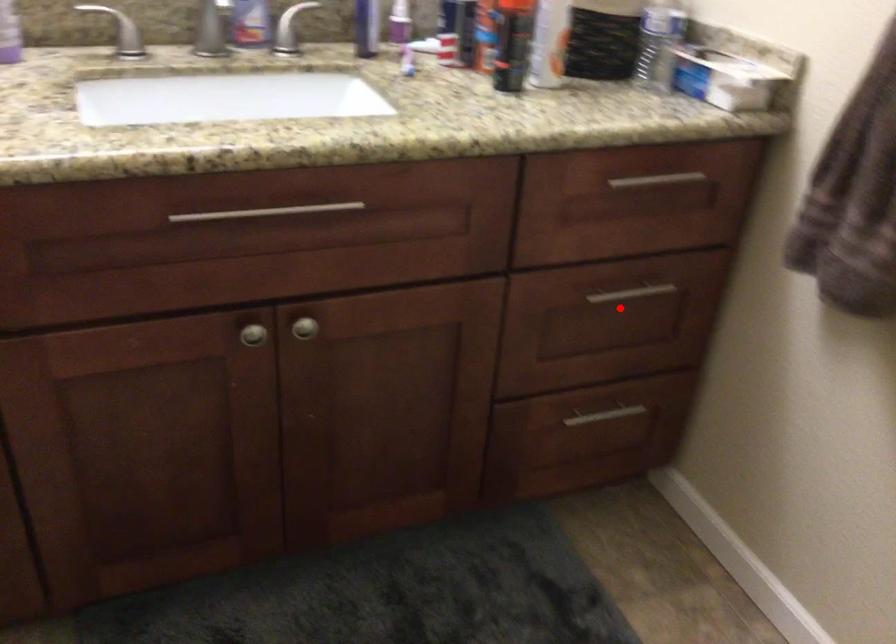
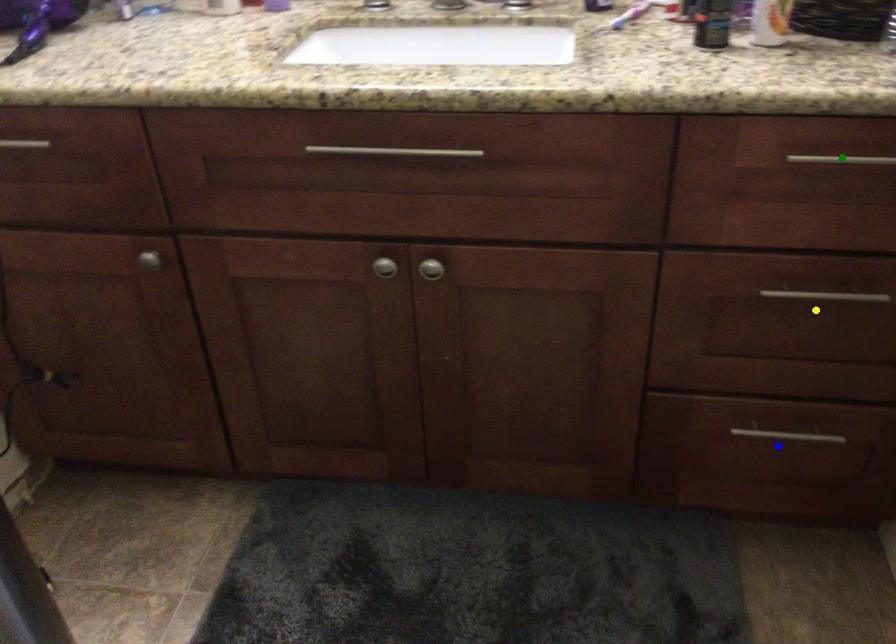
Question: I am providing you with two images of the same scene from different viewpoints. A red point is marked on the first image. You are given multiple points on the second image. Which point in image 2 is actually the same real-world point as the red point in image 1?

Choices:
 (A) yellow point
 (B) blue point
 (C) green point

Answer: (A)